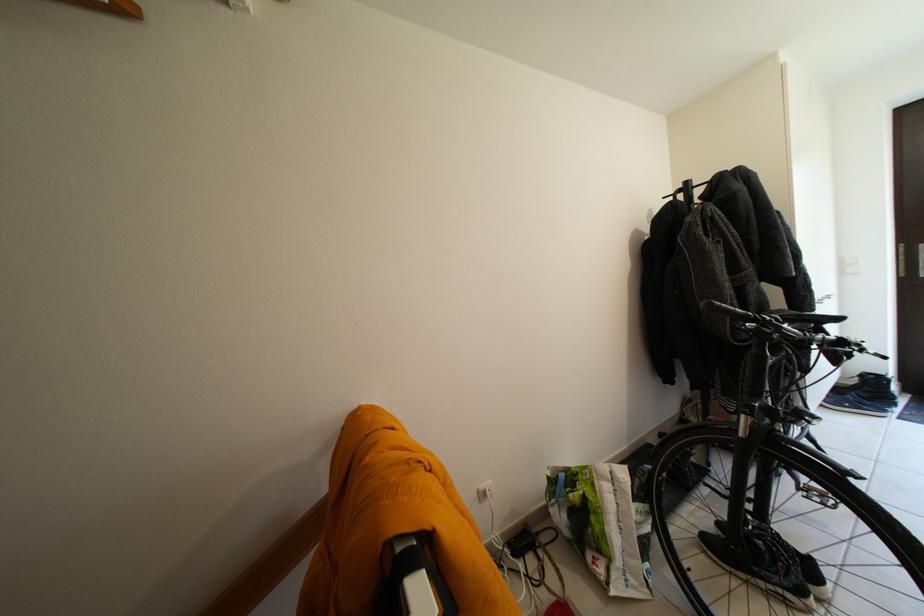
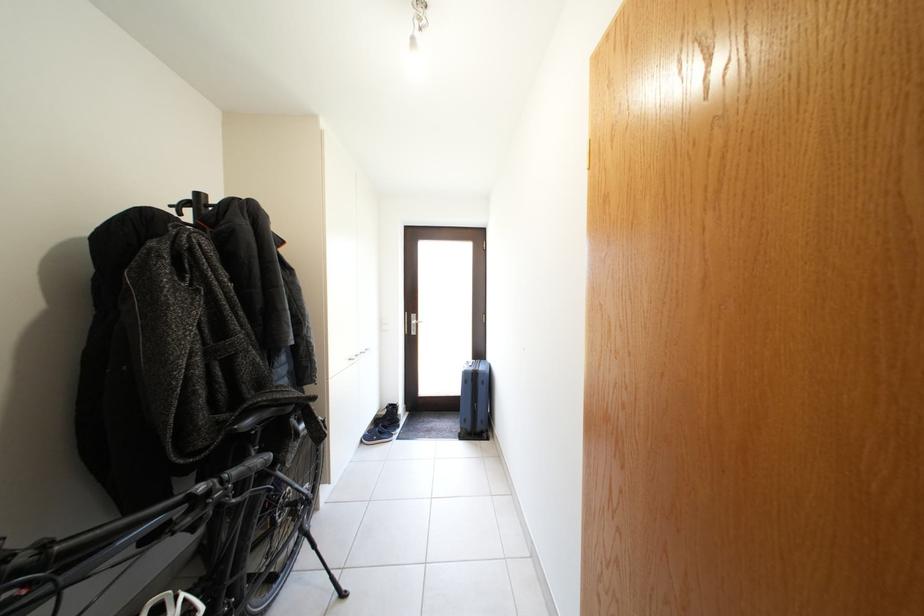
In the second image, find the point that corresponds to (x=696, y=188) in the first image.

(205, 200)